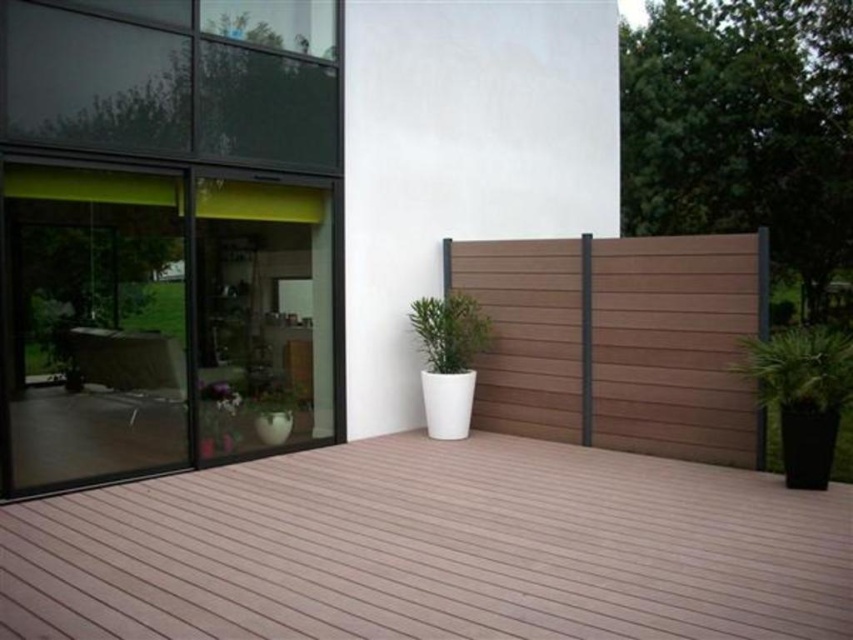
You are a delivery person standing on the brown wood deck at center and need to deliver a package to the transparent glass screen door at center. The delivery robot you are using has a maximum range of 3 meters. Can the robot reach the door from your current position?

The brown wood deck at center is 3.81 meters away from the transparent glass screen door at center. Since the robot has a maximum range of 3 meters, it cannot reach the door from the current position.